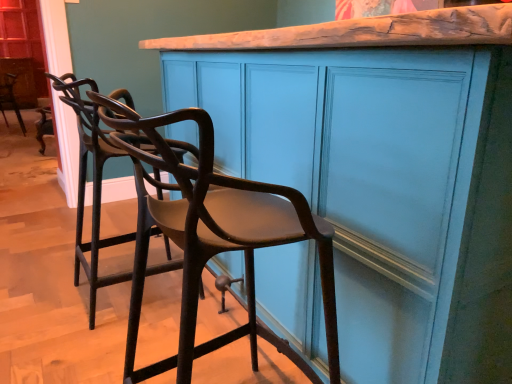
Question: From a real-world perspective, is matte black chair at left, which is counted as the second chair, starting from the left, positioned under matte teal cabinet at center based on gravity?

Choices:
 (A) yes
 (B) no

Answer: (A)

Question: From the image's perspective, would you say matte black chair at left, arranged as the second chair when viewed from the front, is positioned over matte teal cabinet at center?

Choices:
 (A) no
 (B) yes

Answer: (A)

Question: Is matte teal cabinet at center completely or partially inside matte black chair at left, arranged as the second chair when viewed from the front?

Choices:
 (A) no
 (B) yes

Answer: (A)

Question: Does matte black chair at left, arranged as the second chair when viewed from the front, have a greater width compared to matte teal cabinet at center?

Choices:
 (A) no
 (B) yes

Answer: (A)

Question: Can you confirm if matte black chair at left, arranged as the second chair when viewed from the front, is positioned to the left of matte teal cabinet at center?

Choices:
 (A) yes
 (B) no

Answer: (A)

Question: Does matte black chair at left, placed as the 2th chair when sorted from back to front, lie behind matte teal cabinet at center?

Choices:
 (A) no
 (B) yes

Answer: (B)

Question: Can you confirm if metallic dark brown chair at left, which ranks as the third chair in right-to-left order, is positioned to the right of brown wood chair at center, arranged as the first chair when viewed from the front?

Choices:
 (A) no
 (B) yes

Answer: (A)

Question: Is metallic dark brown chair at left, which appears as the third chair when viewed from the front, outside of brown wood chair at center, positioned as the 3th chair in left-to-right order?

Choices:
 (A) yes
 (B) no

Answer: (A)

Question: Can you confirm if metallic dark brown chair at left, which appears as the third chair when viewed from the front, is bigger than brown wood chair at center, positioned as the 3th chair in left-to-right order?

Choices:
 (A) no
 (B) yes

Answer: (B)

Question: Would you consider metallic dark brown chair at left, marked as the 1th chair in a left-to-right arrangement, to be distant from brown wood chair at center, arranged as the first chair when viewed from the front?

Choices:
 (A) yes
 (B) no

Answer: (A)

Question: Is metallic dark brown chair at left, marked as the 1th chair in a left-to-right arrangement, shorter than brown wood chair at center, arranged as the first chair when viewed from the right?

Choices:
 (A) yes
 (B) no

Answer: (A)

Question: Is metallic dark brown chair at left, which appears as the third chair when viewed from the front, closer to camera compared to brown wood chair at center, positioned as the 3th chair in back-to-front order?

Choices:
 (A) no
 (B) yes

Answer: (A)

Question: Is matte teal cabinet at center shorter than brown wood chair at center, positioned as the 3th chair in back-to-front order?

Choices:
 (A) yes
 (B) no

Answer: (B)